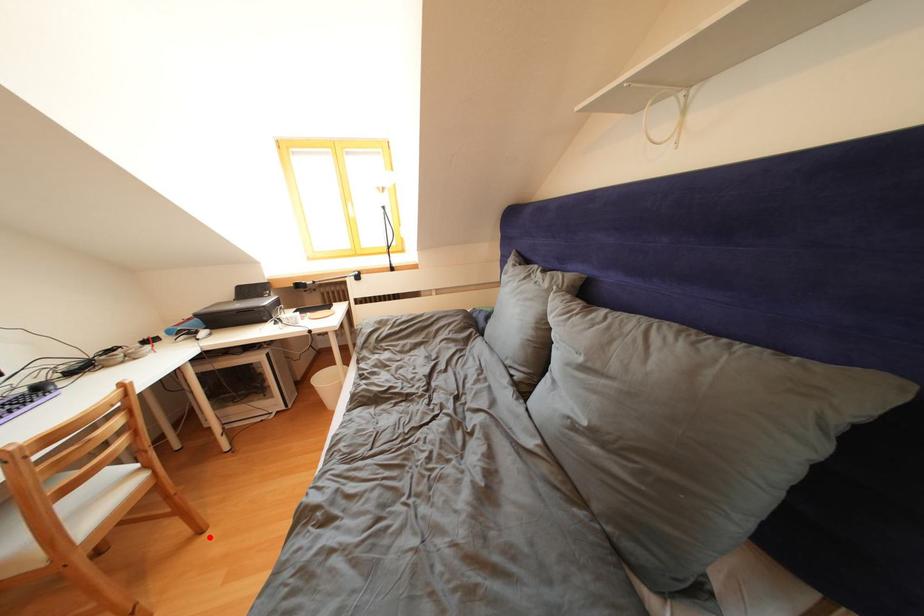
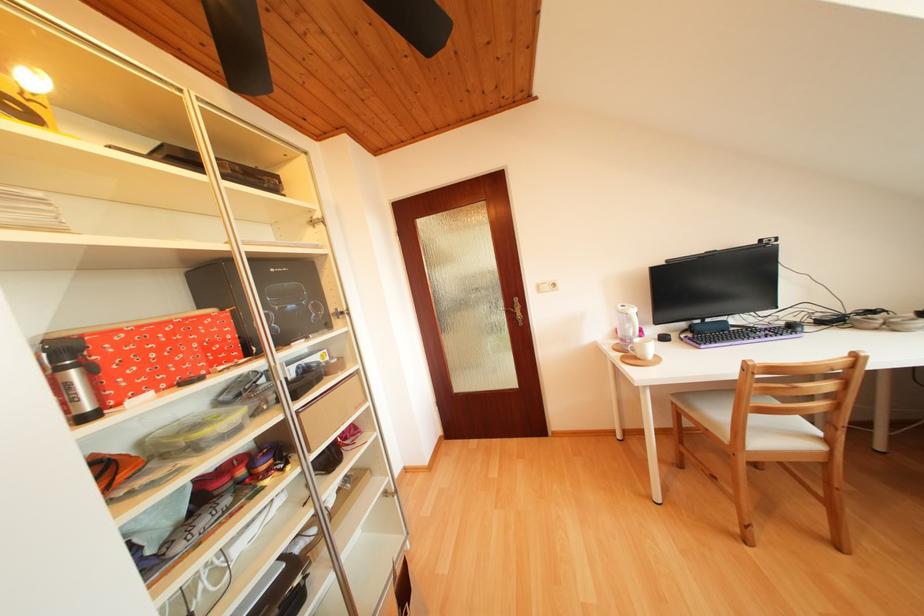
Question: I am providing you with two images of the same scene from different viewpoints. A red point is marked on the first image. Is the red point's position out of view in image 2?

Choices:
 (A) Yes
 (B) No

Answer: (B)